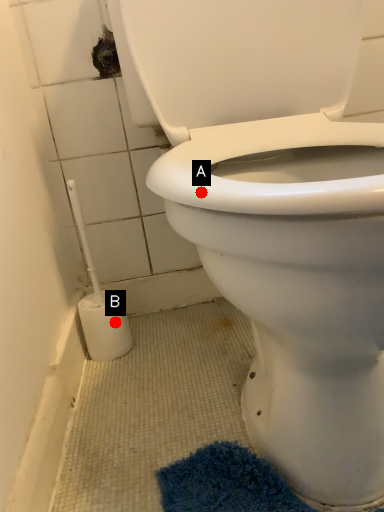
Question: Two points are circled on the image, labeled by A and B beside each circle. Among these points, which one is nearest to the camera?

Choices:
 (A) A is closer
 (B) B is closer

Answer: (A)